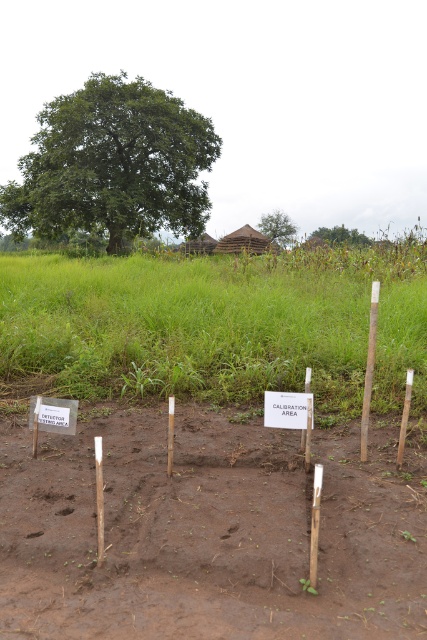
You are a researcher who needs to place a new equipment box that is 1 meter wide. You have to decide between placing it on the brown soil at center or on the white paper sign at center. Based on their widths, which location would allow the equipment box to fit without overhanging?

The brown soil at center is wider than the white paper sign at center, so placing the equipment box on the brown soil at center would allow it to fit without overhanging since it has sufficient width.